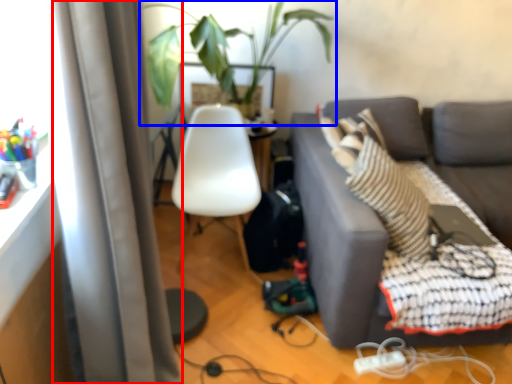
Question: Which of the following is the closest to the observer, curtain (highlighted by a red box) or houseplant (highlighted by a blue box)?

Choices:
 (A) curtain
 (B) houseplant

Answer: (A)